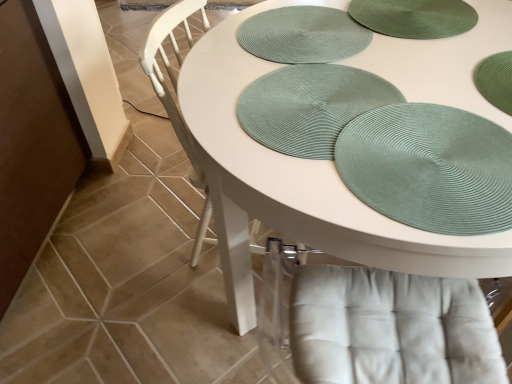
Question: Does green textured placemat at upper right come behind green woven placemat at center, placed as the first platter when sorted from front to back?

Choices:
 (A) no
 (B) yes

Answer: (A)

Question: Is green textured placemat at upper right oriented away from green woven placemat at center, the 2th platter positioned from the back?

Choices:
 (A) yes
 (B) no

Answer: (A)

Question: Can you confirm if green textured placemat at upper right is positioned to the right of green woven placemat at center, the 2th platter positioned from the back?

Choices:
 (A) no
 (B) yes

Answer: (B)

Question: Can you confirm if green textured placemat at upper right is shorter than green woven placemat at center, the 2th platter positioned from the back?

Choices:
 (A) yes
 (B) no

Answer: (B)

Question: Considering the relative sizes of green textured placemat at upper right and green woven placemat at center, the 2th platter positioned from the back, in the image provided, is green textured placemat at upper right wider than green woven placemat at center, the 2th platter positioned from the back,?

Choices:
 (A) yes
 (B) no

Answer: (B)

Question: From the image's perspective, is green textured placemat at upper center, placed as the 1th platter when sorted from back to front, positioned above or below green woven placemat at center, placed as the first platter when sorted from front to back?

Choices:
 (A) above
 (B) below

Answer: (A)

Question: In terms of width, does green textured placemat at upper center, placed as the 1th platter when sorted from back to front, look wider or thinner when compared to green woven placemat at center, the 2th platter positioned from the back?

Choices:
 (A) wide
 (B) thin

Answer: (B)

Question: Is green textured placemat at upper center, placed as the 1th platter when sorted from back to front, bigger or smaller than green woven placemat at center, the 2th platter positioned from the back?

Choices:
 (A) big
 (B) small

Answer: (B)

Question: Would you say green textured placemat at upper center, which ranks as the 2th platter in front-to-back order, is inside or outside green woven placemat at center, the 2th platter positioned from the back?

Choices:
 (A) outside
 (B) inside

Answer: (A)

Question: From a real-world perspective, is green textured placemat at upper right physically located above or below white matte table at center?

Choices:
 (A) below
 (B) above

Answer: (B)

Question: Is green textured placemat at upper right spatially inside white matte table at center, or outside of it?

Choices:
 (A) inside
 (B) outside

Answer: (A)

Question: Is point (468, 148) positioned closer to the camera than point (316, 228)?

Choices:
 (A) farther
 (B) closer

Answer: (A)

Question: Relative to white matte table at center, is green textured placemat at upper right in front or behind?

Choices:
 (A) front
 (B) behind

Answer: (B)

Question: From a real-world perspective, is green textured placemat at upper right above or below green woven placemat at center, placed as the first platter when sorted from front to back?

Choices:
 (A) above
 (B) below

Answer: (A)

Question: Would you say green textured placemat at upper right is to the left or to the right of green woven placemat at center, the 2th platter positioned from the back, in the picture?

Choices:
 (A) right
 (B) left

Answer: (A)